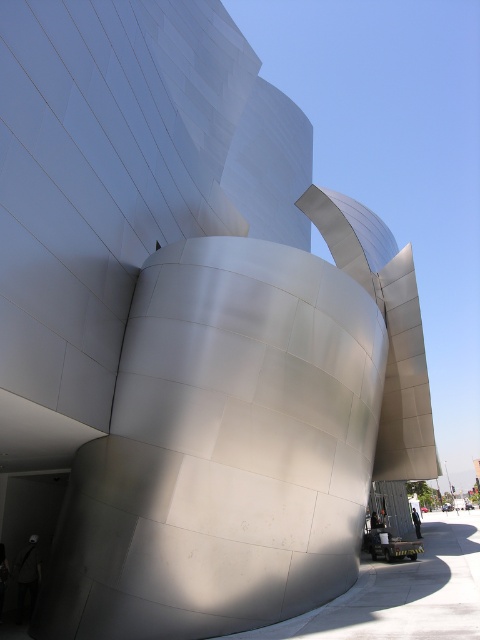
Question: Is the position of dark gray fabric bag at lower left less distant than that of dark blue jeans at lower right?

Choices:
 (A) no
 (B) yes

Answer: (B)

Question: Can you confirm if dark gray fabric bag at lower left is thinner than dark blue jeans at lower right?

Choices:
 (A) yes
 (B) no

Answer: (A)

Question: Which point is farther to the camera?

Choices:
 (A) (20, 577)
 (B) (412, 522)

Answer: (B)

Question: Which of the following is the farthest from the observer?

Choices:
 (A) dark gray fabric bag at lower left
 (B) dark blue jeans at lower right

Answer: (B)

Question: Can you confirm if dark gray fabric bag at lower left is smaller than dark blue jeans at lower right?

Choices:
 (A) yes
 (B) no

Answer: (A)